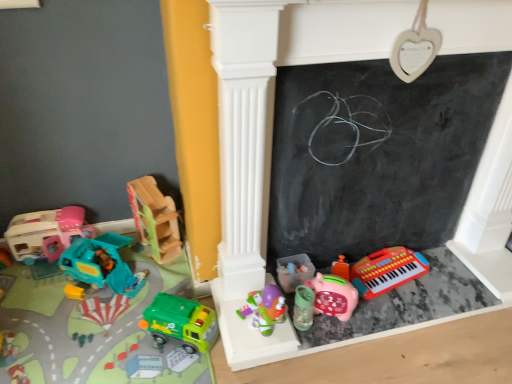
Question: Does green plastic toy truck at lower left, the fourth toy positioned from the left, have a greater width compared to wooden truck at left, acting as the 3th toy starting from the left?

Choices:
 (A) yes
 (B) no

Answer: (B)

Question: Is green plastic toy truck at lower left, which is the 4th toy in right-to-left order, at the right side of wooden truck at left, acting as the 3th toy starting from the left?

Choices:
 (A) no
 (B) yes

Answer: (B)

Question: Does green plastic toy truck at lower left, the fourth toy positioned from the left, have a greater height compared to wooden truck at left, acting as the 3th toy starting from the left?

Choices:
 (A) yes
 (B) no

Answer: (B)

Question: Is green plastic toy truck at lower left, the fourth toy positioned from the left, outside of wooden truck at left, the fifth toy in the right-to-left sequence?

Choices:
 (A) yes
 (B) no

Answer: (A)

Question: From the image's perspective, is green plastic toy truck at lower left, which is the 4th toy in right-to-left order, above wooden truck at left, acting as the 3th toy starting from the left?

Choices:
 (A) no
 (B) yes

Answer: (A)

Question: Considering the relative sizes of green plastic toy truck at lower left, the fourth toy positioned from the left, and wooden truck at left, the fifth toy in the right-to-left sequence, in the image provided, is green plastic toy truck at lower left, the fourth toy positioned from the left, bigger than wooden truck at left, the fifth toy in the right-to-left sequence,?

Choices:
 (A) no
 (B) yes

Answer: (A)

Question: Is rubberized plastic keyboard at lower right, which is the 7th toy in left-to-right order, outside of pink matte piggy bank at lower center, which is the 6th toy in left-to-right order?

Choices:
 (A) no
 (B) yes

Answer: (B)

Question: Can you confirm if rubberized plastic keyboard at lower right, which is the 7th toy in left-to-right order, is taller than pink matte piggy bank at lower center, positioned as the second toy in right-to-left order?

Choices:
 (A) no
 (B) yes

Answer: (A)

Question: Would you say pink matte piggy bank at lower center, positioned as the second toy in right-to-left order, is part of rubberized plastic keyboard at lower right, which is the 7th toy in left-to-right order,'s contents?

Choices:
 (A) no
 (B) yes

Answer: (A)

Question: From the image's perspective, is rubberized plastic keyboard at lower right, which is the 7th toy in left-to-right order, on pink matte piggy bank at lower center, which is the 6th toy in left-to-right order?

Choices:
 (A) yes
 (B) no

Answer: (A)

Question: Can you confirm if rubberized plastic keyboard at lower right, which is the 7th toy in left-to-right order, is positioned to the right of pink matte piggy bank at lower center, which is the 6th toy in left-to-right order?

Choices:
 (A) yes
 (B) no

Answer: (A)

Question: Are rubberized plastic keyboard at lower right, which is the 7th toy in left-to-right order, and pink matte piggy bank at lower center, positioned as the second toy in right-to-left order, far apart?

Choices:
 (A) yes
 (B) no

Answer: (B)

Question: Does pink plastic keyboard at lower right have a larger size compared to wooden truck at left, the fifth toy in the right-to-left sequence?

Choices:
 (A) yes
 (B) no

Answer: (A)